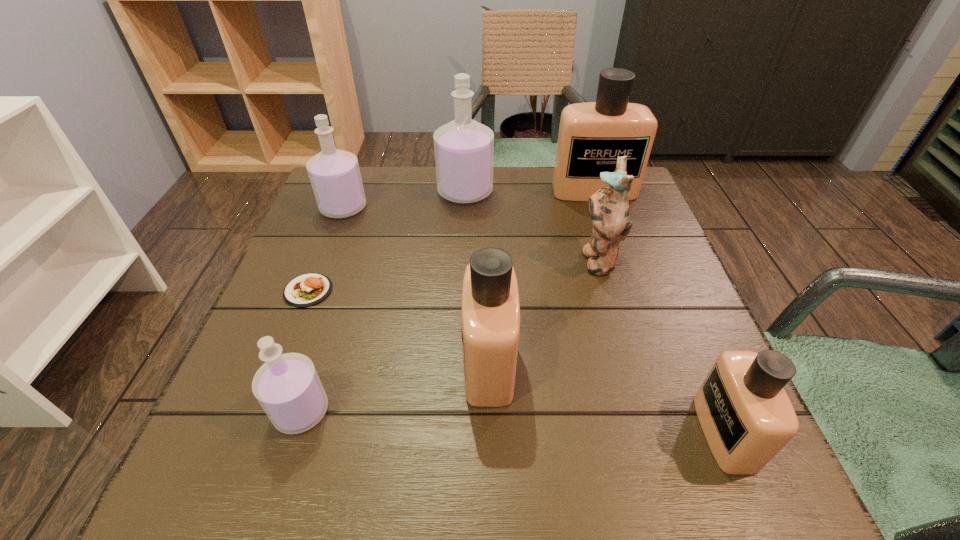
What are the coordinates of `free space at the left edge` in the screenshot? It's located at (348, 278).

Identify the location of vacant region at the right edge of the desktop. This screenshot has width=960, height=540. (684, 314).

In the image, there is a desktop. Find the location of `free space at the far left corner`. free space at the far left corner is located at coordinates (363, 178).

In the image, there is a desktop. Identify the location of vacant space at the near left corner. This screenshot has height=540, width=960. (220, 484).

At what (x,y) coordinates should I click in order to perform the action: click on vacant space at the near right corner of the desktop. Please return your answer as a coordinate pair (x, y). This screenshot has height=540, width=960. Looking at the image, I should click on (714, 462).

Identify the location of vacant space in between the rightmost purple perfume and the nearest purple perfume. The height and width of the screenshot is (540, 960). (383, 301).

You are a GUI agent. You are given a task and a screenshot of the screen. Output one action in this format:
    pyautogui.click(x=<x>, y=<y>)
    Task: Click on the vacant space that's between the nearest purple perfume and the patty (food)
    
    Given the screenshot: What is the action you would take?
    pyautogui.click(x=305, y=351)

Where is `free spot between the second smallest purple perfume and the figurine`? The image size is (960, 540). free spot between the second smallest purple perfume and the figurine is located at coordinates (470, 233).

This screenshot has height=540, width=960. Find the location of `free space between the nearest purple perfume and the figurine`. free space between the nearest purple perfume and the figurine is located at coordinates (449, 335).

Identify the location of unoccupied position between the rightmost purple perfume and the smallest beige perfume. The width and height of the screenshot is (960, 540). (594, 312).